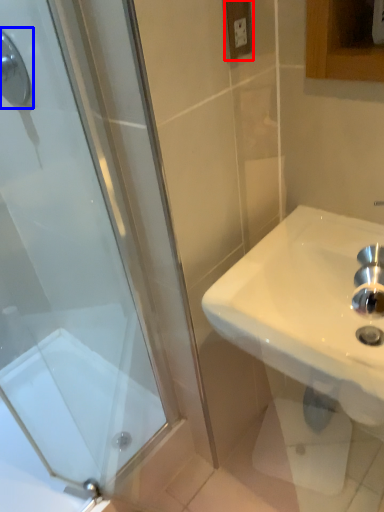
Question: Which object appears farthest to the camera in this image, electric outlet (highlighted by a red box) or shower (highlighted by a blue box)?

Choices:
 (A) electric outlet
 (B) shower

Answer: (B)